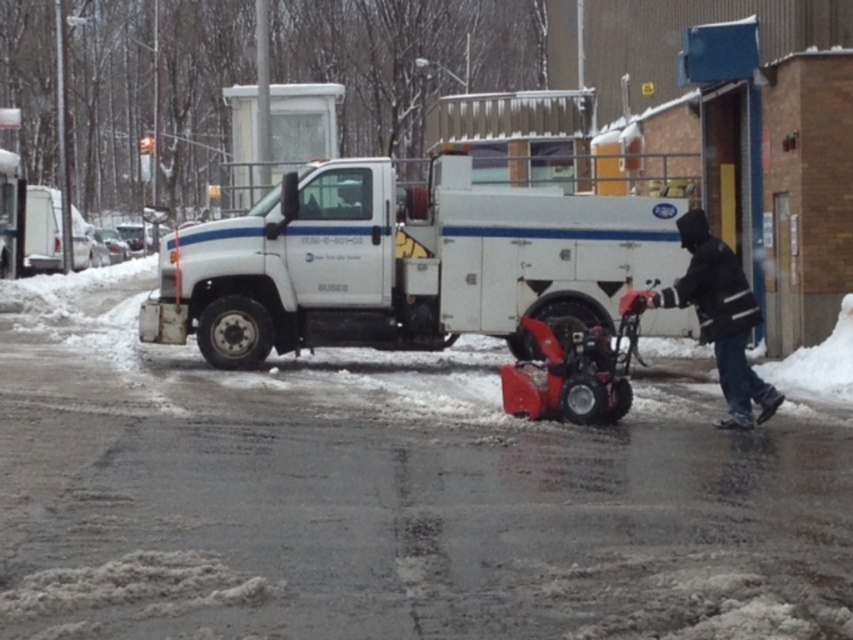
You are a delivery person trying to navigate through the snowy street. The white matte truck at center and the black matte jacket at center are in your path. Which object is narrower, allowing you to pass through more easily?

The white matte truck at center is thinner than the black matte jacket at center, so you can pass through more easily around the white matte truck at center.

You are standing at the edge of the snowy street and want to walk towards the white matte truck at center and the black matte jacket at center. Which object will you reach first?

You will reach the white matte truck at center first because it is closer to you than the black matte jacket at center, which is further away.